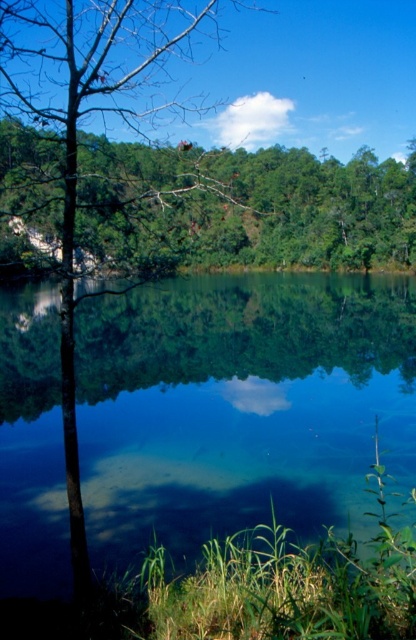
You are an artist trying to paint the scene. You want to ensure the clear glass water at center and the green matte tree at upper center are proportionally accurate. Which object should you paint first if you want to start with the larger one?

The green matte tree at upper center should be painted first because it is larger than the clear glass water at center according to the description.

From the picture: You are an artist trying to paint the scene. You want to ensure the sizes of the green matte tree at upper center and the smooth bark tree at center are accurate. Which tree should you paint larger?

The green matte tree at upper center should be painted larger than the smooth bark tree at center because it is bigger according to the description.

You are an artist trying to paint the scene. You need to decide which object, the clear glass water at center or the green matte tree at upper center, should be placed lower in your painting to maintain the scene proportions. Which one should you paint lower?

The clear glass water at center has a lesser height compared to the green matte tree at upper center, so you should paint the clear glass water at center lower to maintain the scene proportions.